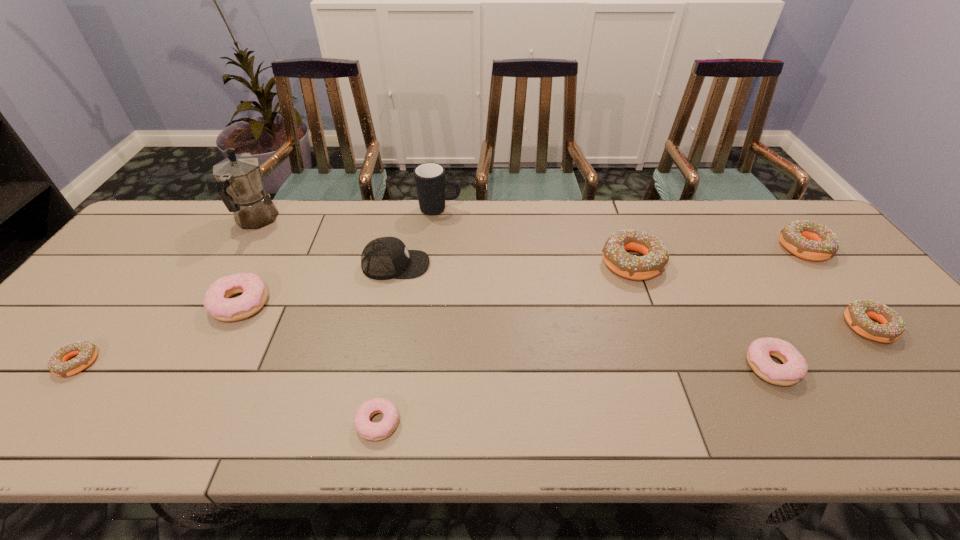
Identify which chocolate doughnut is the second nearest to the tallest object. Please provide its 2D coordinates. Your answer should be formatted as a tuple, i.e. [(x, y)], where the tuple contains the x and y coordinates of a point satisfying the conditions above.

[(656, 256)]

I want to click on the third closest pink doughnut to the fourth object from right to left, so (216, 301).

Image resolution: width=960 pixels, height=540 pixels. I want to click on pink doughnut identified as the closest to the second smallest chocolate doughnut, so click(794, 368).

Locate an element on the screen. This screenshot has height=540, width=960. free region that satisfies the following two spatial constraints: 1. on the back side of the biggest pink doughnut; 2. on the right side of the nearest chocolate doughnut is located at coordinates (124, 303).

This screenshot has height=540, width=960. Find the location of `free location that satisfies the following two spatial constraints: 1. on the back side of the fourth object from right to left; 2. on the left side of the nearest pink doughnut`. free location that satisfies the following two spatial constraints: 1. on the back side of the fourth object from right to left; 2. on the left side of the nearest pink doughnut is located at coordinates (406, 262).

The height and width of the screenshot is (540, 960). In order to click on free spot that satisfies the following two spatial constraints: 1. on the side of the mug with the handle; 2. on the right side of the third object from right to left in this screenshot , I will do `click(421, 366)`.

This screenshot has width=960, height=540. Find the location of `free spot that satisfies the following two spatial constraints: 1. on the back side of the third doughnut from right to left; 2. on the front-facing side of the third tallest object`. free spot that satisfies the following two spatial constraints: 1. on the back side of the third doughnut from right to left; 2. on the front-facing side of the third tallest object is located at coordinates (714, 265).